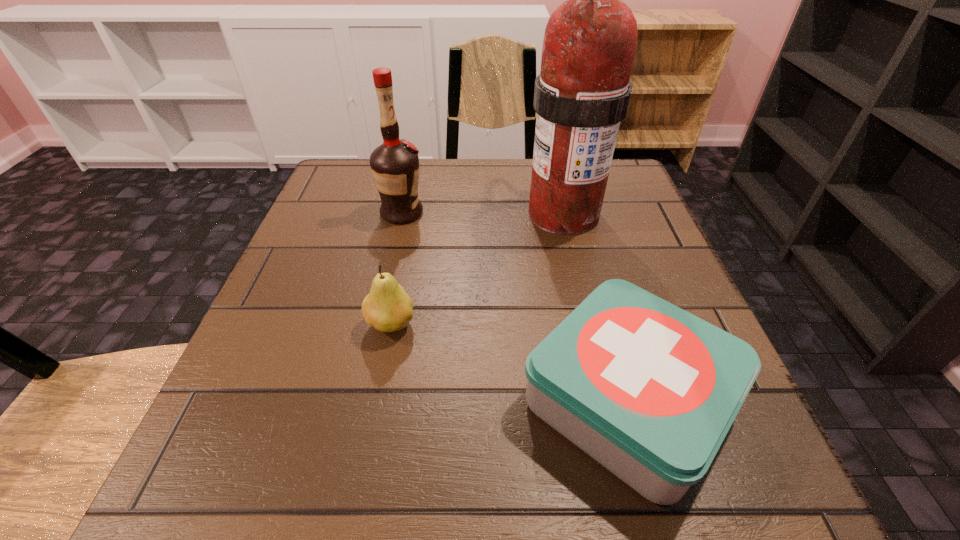
The width and height of the screenshot is (960, 540). Identify the location of unoccupied position between the liquor and the first-aid kit. (515, 307).

This screenshot has width=960, height=540. I want to click on unoccupied area between the liquor and the second shortest object, so click(x=396, y=269).

Where is `the third closest object to the third tallest object`? the third closest object to the third tallest object is located at coordinates (x=582, y=94).

Choose which object is the third nearest neighbor to the third shortest object. Please provide its 2D coordinates. Your answer should be formatted as a tuple, i.e. [(x, y)], where the tuple contains the x and y coordinates of a point satisfying the conditions above.

[(648, 390)]

I want to click on vacant space that satisfies the following two spatial constraints: 1. on the front and back of the second tallest object; 2. on the left side of the first-aid kit, so click(360, 400).

At what (x,y) coordinates should I click in order to perform the action: click on vacant area that satisfies the following two spatial constraints: 1. on the front and back of the second shortest object; 2. on the left side of the third shortest object. Please return your answer as a coordinate pair (x, y). The width and height of the screenshot is (960, 540). Looking at the image, I should click on (377, 324).

What are the coordinates of `vacant position in the image that satisfies the following two spatial constraints: 1. on the front and back of the third tallest object; 2. on the right side of the liquor` in the screenshot? It's located at (377, 324).

You are a GUI agent. You are given a task and a screenshot of the screen. Output one action in this format:
    pyautogui.click(x=<x>, y=<y>)
    Task: Click on the free spot that satisfies the following two spatial constraints: 1. on the front and back of the pear; 2. on the right side of the second tallest object
    
    Given the screenshot: What is the action you would take?
    pyautogui.click(x=377, y=324)

Locate an element on the screen. The height and width of the screenshot is (540, 960). free space that satisfies the following two spatial constraints: 1. on the front and back of the third shortest object; 2. on the right side of the third tallest object is located at coordinates (377, 324).

Where is `free space in the image that satisfies the following two spatial constraints: 1. on the front and back of the liquor; 2. on the left side of the pear`? Image resolution: width=960 pixels, height=540 pixels. free space in the image that satisfies the following two spatial constraints: 1. on the front and back of the liquor; 2. on the left side of the pear is located at coordinates (377, 324).